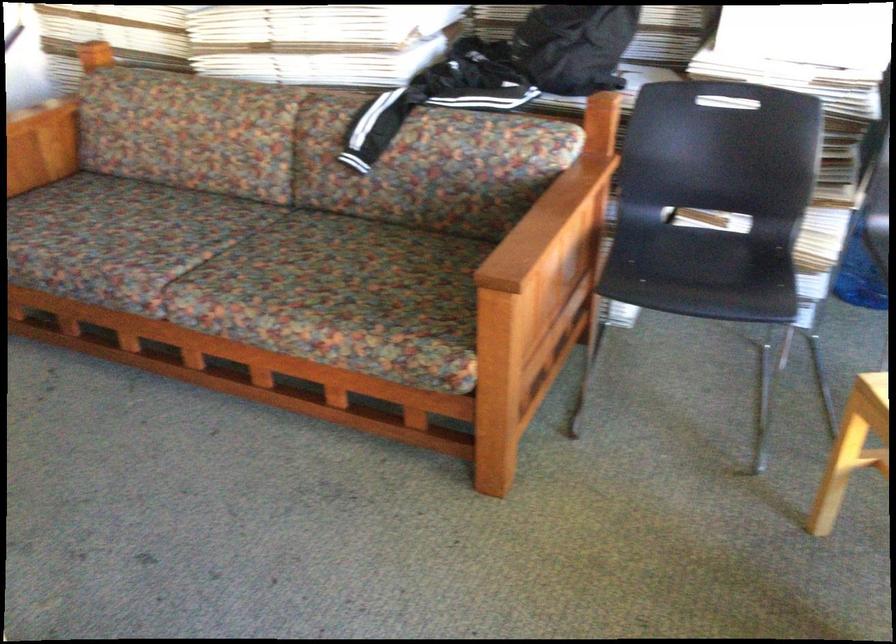
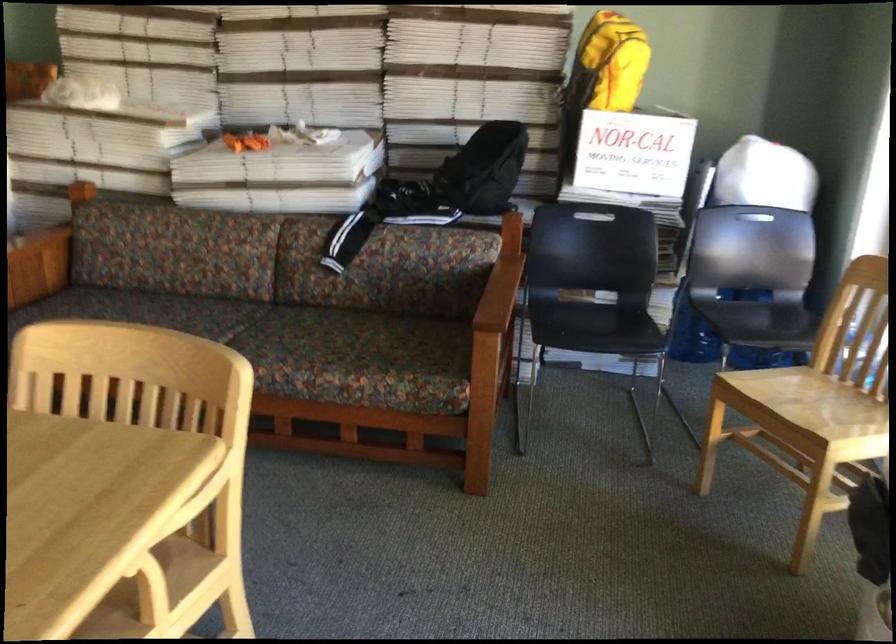
Question: The camera is either moving clockwise (left) or counter-clockwise (right) around the object. The first image is from the beginning of the video and the second image is from the end. Is the camera moving left or right when shooting the video?

Choices:
 (A) Left
 (B) Right

Answer: (A)